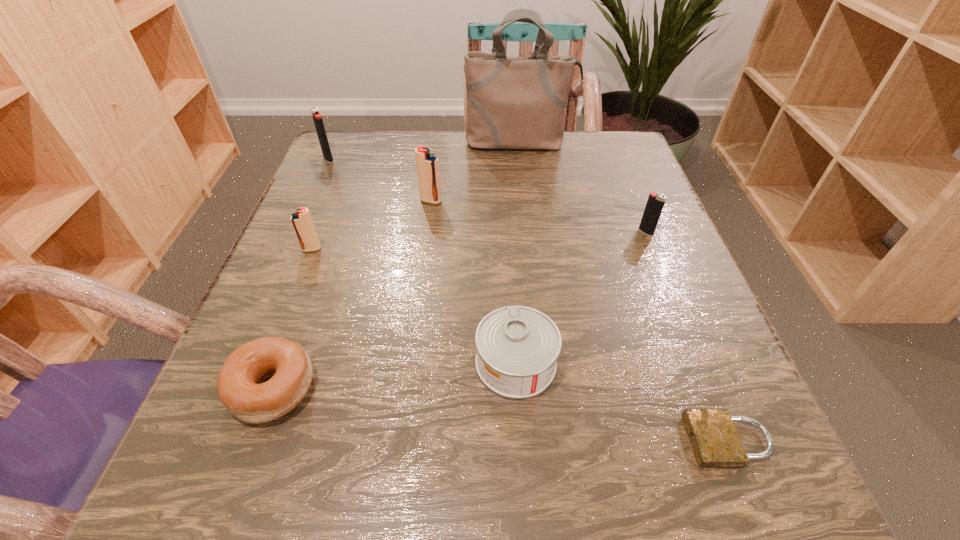
I want to click on object that is at the far left corner, so click(317, 118).

At what (x,y) coordinates should I click in order to perform the action: click on object positioned at the far right corner. Please return your answer as a coordinate pair (x, y). The image size is (960, 540). Looking at the image, I should click on (512, 102).

The height and width of the screenshot is (540, 960). Find the location of `object located at the near right corner`. object located at the near right corner is located at coordinates click(x=715, y=441).

The width and height of the screenshot is (960, 540). In the image, there is a desktop. Identify the location of vacant space at the far edge. (544, 185).

You are a GUI agent. You are given a task and a screenshot of the screen. Output one action in this format:
    pyautogui.click(x=<x>, y=<y>)
    Task: Click on the free spot at the near edge of the desktop
    The width and height of the screenshot is (960, 540).
    Given the screenshot: What is the action you would take?
    pyautogui.click(x=398, y=454)

Where is `blank space at the left edge of the desktop`? This screenshot has width=960, height=540. blank space at the left edge of the desktop is located at coordinates (336, 376).

You are a GUI agent. You are given a task and a screenshot of the screen. Output one action in this format:
    pyautogui.click(x=<x>, y=<y>)
    Task: Click on the vacant point at the right edge
    Image resolution: width=960 pixels, height=540 pixels.
    Given the screenshot: What is the action you would take?
    pyautogui.click(x=677, y=340)

You are a GUI agent. You are given a task and a screenshot of the screen. Output one action in this format:
    pyautogui.click(x=<x>, y=<y>)
    Task: Click on the vacant area at the far left corner of the desktop
    The height and width of the screenshot is (540, 960).
    Given the screenshot: What is the action you would take?
    pyautogui.click(x=353, y=163)

Identify the location of free location at the near left corner. (175, 474).

Locate an element on the screen. vacant space at the far right corner of the desktop is located at coordinates (640, 161).